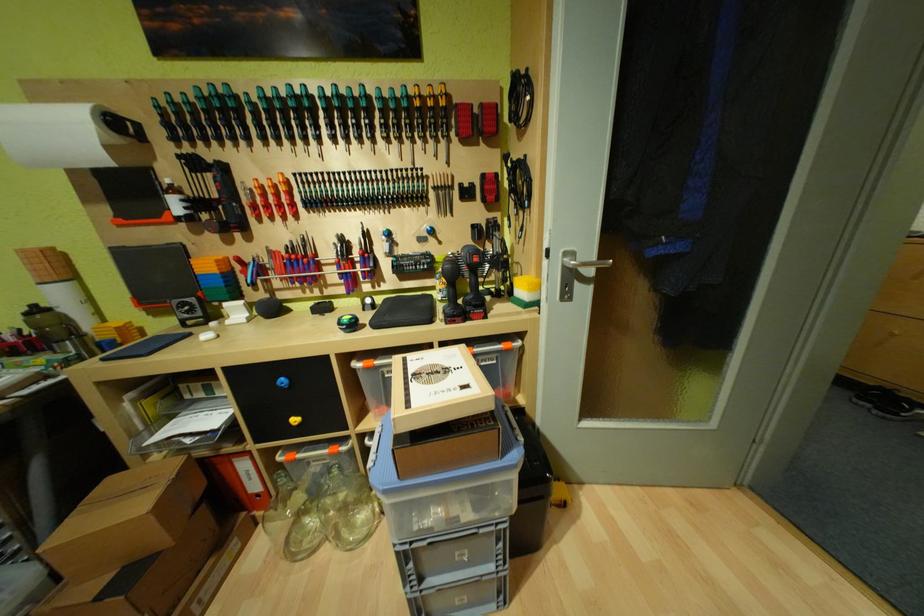
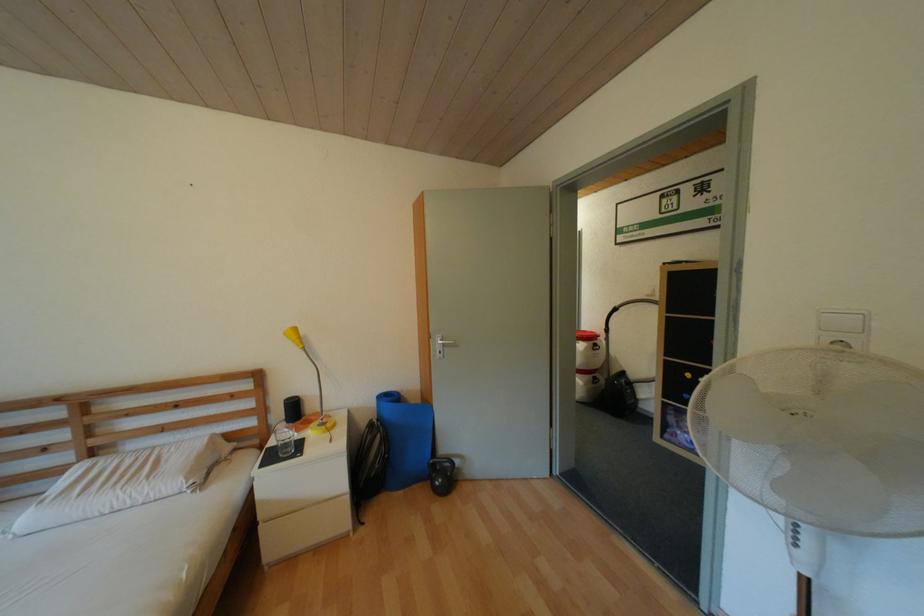
Question: Which direction would the cameraman need to move to produce the second image? Reply with the corresponding letter.

Choices:
 (A) Left
 (B) Right
 (C) Forward
 (D) Backward

Answer: (C)